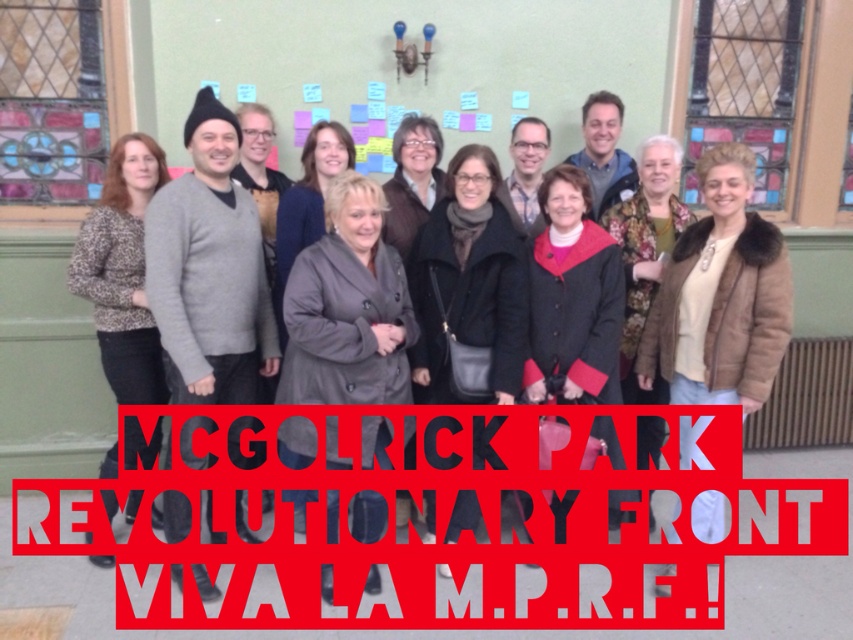
Is point (669, 467) positioned after point (612, 452)?

Yes, it is.

Does black plastic sign at center appear on the right side of matte gray sweater at center?

Yes, black plastic sign at center is to the right of matte gray sweater at center.

Image resolution: width=853 pixels, height=640 pixels. Describe the element at coordinates (434, 525) in the screenshot. I see `black plastic sign at center` at that location.

Identify the location of black plastic sign at center. Image resolution: width=853 pixels, height=640 pixels. (434, 525).